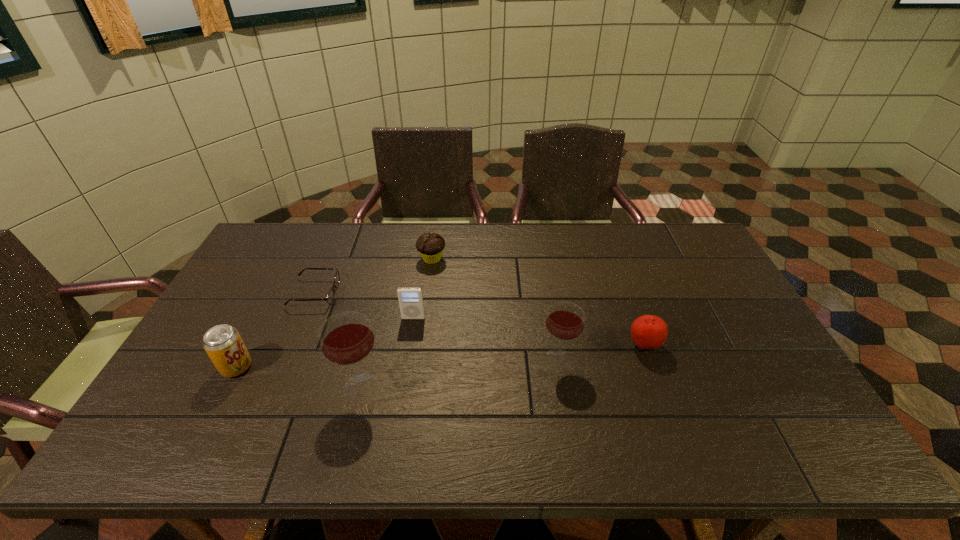
Locate an element on the screen. The image size is (960, 540). vacant space at the far edge of the desktop is located at coordinates (645, 254).

Locate an element on the screen. The width and height of the screenshot is (960, 540). free space at the near edge of the desktop is located at coordinates (697, 392).

Locate an element on the screen. This screenshot has width=960, height=540. free location at the right edge of the desktop is located at coordinates (739, 305).

At what (x,y) coordinates should I click in order to perform the action: click on vacant area at the far left corner of the desktop. Please return your answer as a coordinate pair (x, y). This screenshot has height=540, width=960. Looking at the image, I should click on (287, 224).

This screenshot has height=540, width=960. I want to click on vacant space at the near right corner of the desktop, so click(747, 395).

You are a GUI agent. You are given a task and a screenshot of the screen. Output one action in this format:
    pyautogui.click(x=<x>, y=<y>)
    Task: Click on the empty location between the second object from left to right and the sixth object from left to right
    This screenshot has width=960, height=540.
    Given the screenshot: What is the action you would take?
    (x=437, y=326)

In order to click on vacant space that's between the right wineglass and the rightmost object in this screenshot , I will do `click(602, 352)`.

The width and height of the screenshot is (960, 540). Identify the location of empty space that is in between the right wineglass and the farthest object. (495, 309).

Identify the location of vacant region between the taller wineglass and the second object from right to left. (460, 373).

Image resolution: width=960 pixels, height=540 pixels. Find the location of `vacant area between the second tallest object and the shortest object`. vacant area between the second tallest object and the shortest object is located at coordinates (437, 326).